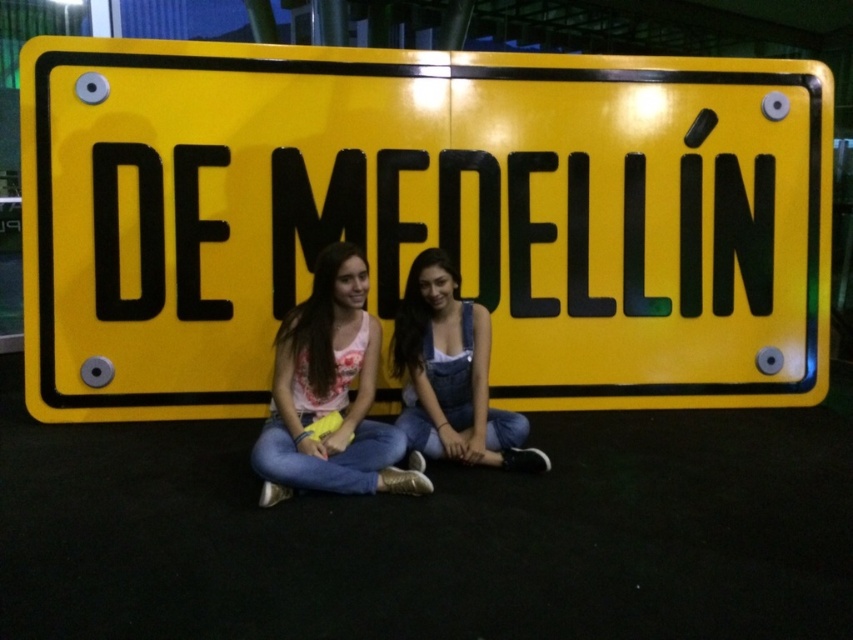
Can you confirm if yellow matte sign at center is taller than denim overalls at center?

Indeed, yellow matte sign at center has a greater height compared to denim overalls at center.

Which is in front, point (811, 192) or point (463, 372)?

Positioned in front is point (463, 372).

Which is in front, point (131, 332) or point (442, 285)?

Positioned in front is point (442, 285).

Where is `yellow matte sign at center`? Image resolution: width=853 pixels, height=640 pixels. yellow matte sign at center is located at coordinates (422, 218).

In the scene shown: Can you confirm if yellow matte sign at center is taller than matte pink shirt at center?

Indeed, yellow matte sign at center has a greater height compared to matte pink shirt at center.

Consider the image. Can you confirm if yellow matte sign at center is positioned to the left of matte pink shirt at center?

Incorrect, yellow matte sign at center is not on the left side of matte pink shirt at center.

What do you see at coordinates (422, 218) in the screenshot? I see `yellow matte sign at center` at bounding box center [422, 218].

Where is `yellow matte sign at center`? The image size is (853, 640). yellow matte sign at center is located at coordinates (422, 218).

Which is more to the left, matte pink shirt at center or denim overalls at center?

From the viewer's perspective, matte pink shirt at center appears more on the left side.

The width and height of the screenshot is (853, 640). I want to click on matte pink shirt at center, so click(x=329, y=394).

Between point (344, 273) and point (445, 440), which one is positioned in front?

Positioned in front is point (344, 273).

This screenshot has width=853, height=640. What are the coordinates of `matte pink shirt at center` in the screenshot? It's located at (329, 394).